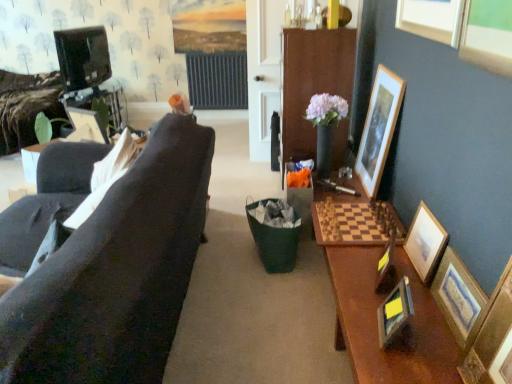
Question: Is wooden framed picture at right, the 1th picture frame viewed from the right, behind black glossy television at upper left?

Choices:
 (A) no
 (B) yes

Answer: (A)

Question: Is black glossy television at upper left surrounded by wooden framed picture at right, placed as the 7th picture frame when sorted from left to right?

Choices:
 (A) no
 (B) yes

Answer: (A)

Question: Does wooden framed picture at right, the 1th picture frame viewed from the right, have a larger size compared to black glossy television at upper left?

Choices:
 (A) no
 (B) yes

Answer: (A)

Question: Is wooden framed picture at right, placed as the 7th picture frame when sorted from left to right, not inside black glossy television at upper left?

Choices:
 (A) no
 (B) yes

Answer: (B)

Question: Can you confirm if wooden framed picture at right, the 1th picture frame viewed from the right, is positioned to the left of black glossy television at upper left?

Choices:
 (A) yes
 (B) no

Answer: (B)

Question: Can you confirm if wooden framed picture at right, the 1th picture frame viewed from the right, is wider than black glossy television at upper left?

Choices:
 (A) no
 (B) yes

Answer: (A)

Question: Considering the relative sizes of black glossy television at upper left and wooden picture frame at lower right, which is the third picture frame from left to right, in the image provided, is black glossy television at upper left thinner than wooden picture frame at lower right, which is the third picture frame from left to right,?

Choices:
 (A) yes
 (B) no

Answer: (B)

Question: Does black glossy television at upper left have a smaller size compared to wooden picture frame at lower right, which is the third picture frame from left to right?

Choices:
 (A) yes
 (B) no

Answer: (B)

Question: Is the position of black glossy television at upper left less distant than that of wooden picture frame at lower right, which is the third picture frame from left to right?

Choices:
 (A) no
 (B) yes

Answer: (A)

Question: From the image's perspective, is black glossy television at upper left below wooden picture frame at lower right, the fifth picture frame when ordered from right to left?

Choices:
 (A) yes
 (B) no

Answer: (B)

Question: Can we say black glossy television at upper left lies outside wooden picture frame at lower right, the fifth picture frame when ordered from right to left?

Choices:
 (A) no
 (B) yes

Answer: (B)

Question: Considering the relative sizes of black glossy television at upper left and wooden picture frame at lower right, which is the third picture frame from left to right, in the image provided, is black glossy television at upper left wider than wooden picture frame at lower right, which is the third picture frame from left to right,?

Choices:
 (A) no
 (B) yes

Answer: (B)

Question: Is wooden picture frame at right, arranged as the 2th picture frame when viewed from the right, wider than wooden picture frame at right, the 5th picture frame from the left?

Choices:
 (A) yes
 (B) no

Answer: (B)